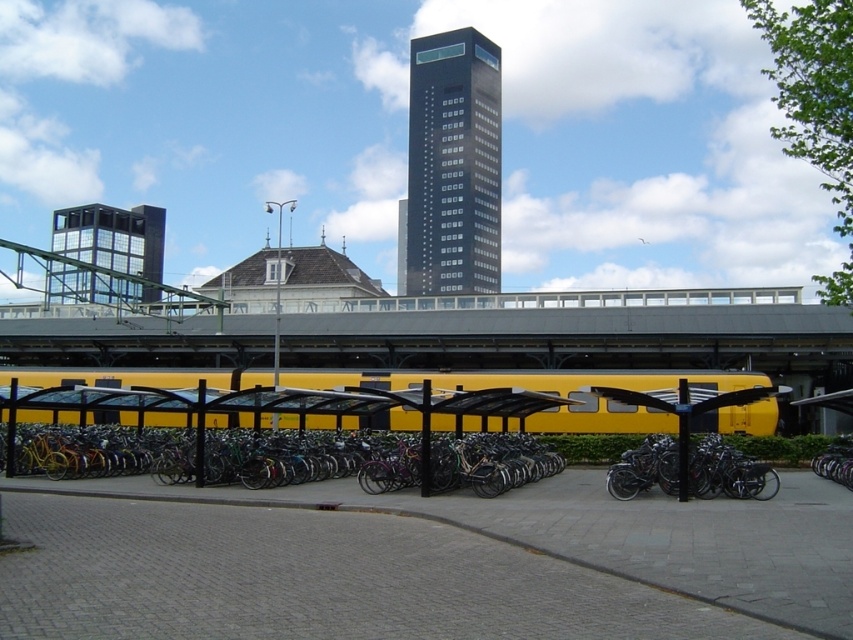
Is point (462, 113) positioned after point (134, 237)?

Yes, it is behind point (134, 237).

Who is positioned more to the right, black glass tower at upper center or glassy reflective tower at upper left?

black glass tower at upper center is more to the right.

Is point (434, 44) positioned behind point (85, 216)?

That is True.

At what (x,y) coordinates should I click in order to perform the action: click on black glass tower at upper center. Please return your answer as a coordinate pair (x, y). Image resolution: width=853 pixels, height=640 pixels. Looking at the image, I should click on (453, 164).

Which is behind, point (747, 612) or point (492, 248)?

The point (492, 248) is behind.

Does gray concrete pavement at lower center appear over black glass tower at upper center?

No, gray concrete pavement at lower center is not above black glass tower at upper center.

At what (x,y) coordinates should I click in order to perform the action: click on gray concrete pavement at lower center. Please return your answer as a coordinate pair (x, y). The width and height of the screenshot is (853, 640). Looking at the image, I should click on (614, 534).

What are the coordinates of `gray concrete pavement at lower center` in the screenshot? It's located at (614, 534).

Is point (780, 508) positioned after point (119, 298)?

No.

In order to click on gray concrete pavement at lower center in this screenshot , I will do `click(614, 534)`.